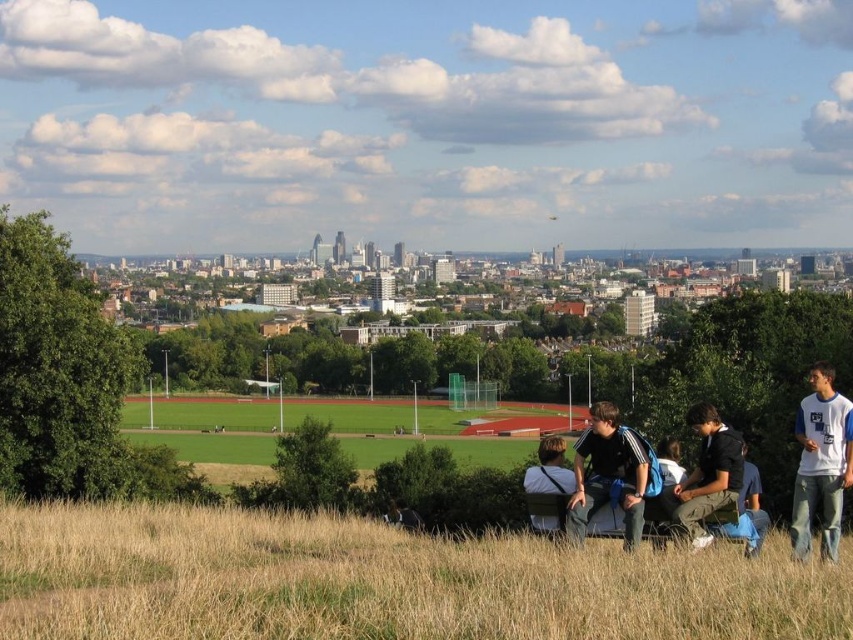
Is dry grass at lower center shorter than white cotton shirt at right?

Indeed, dry grass at lower center has a lesser height compared to white cotton shirt at right.

Between dry grass at lower center and white cotton shirt at right, which one appears on the right side from the viewer's perspective?

Positioned to the right is white cotton shirt at right.

Where is `dry grass at lower center`? dry grass at lower center is located at coordinates (384, 580).

Between point (714, 534) and point (843, 435), which one is positioned behind?

Positioned behind is point (843, 435).

Which is behind, point (799, 456) or point (828, 436)?

Point (828, 436)

You are a GUI agent. You are given a task and a screenshot of the screen. Output one action in this format:
    pyautogui.click(x=<x>, y=<y>)
    Task: Click on the dark blue jeans at lower right
    
    Given the screenshot: What is the action you would take?
    pyautogui.click(x=821, y=464)

Does dry grass at lower center come in front of dark blue jeans at lower right?

That is True.

Measure the distance from dry grass at lower center to dark blue jeans at lower right.

A distance of 52.84 meters exists between dry grass at lower center and dark blue jeans at lower right.

Locate an element on the screen. This screenshot has height=640, width=853. dry grass at lower center is located at coordinates (384, 580).

You are a GUI agent. You are given a task and a screenshot of the screen. Output one action in this format:
    pyautogui.click(x=<x>, y=<y>)
    Task: Click on the dry grass at lower center
    
    Given the screenshot: What is the action you would take?
    pyautogui.click(x=384, y=580)